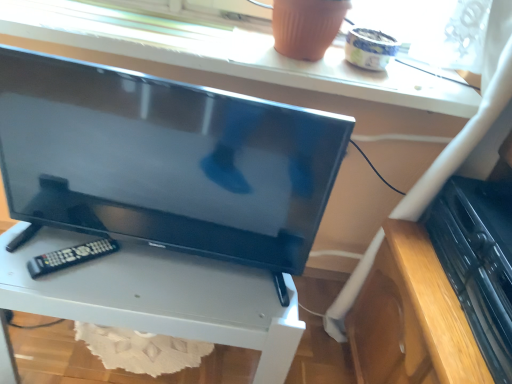
Image resolution: width=512 pixels, height=384 pixels. I want to click on white glossy tv stand at center, so click(158, 296).

What do you see at coordinates (158, 296) in the screenshot? Image resolution: width=512 pixels, height=384 pixels. I see `white glossy tv stand at center` at bounding box center [158, 296].

Find the location of a particular element. black plastic remote at lower left is located at coordinates (70, 256).

Image resolution: width=512 pixels, height=384 pixels. Find the location of `white glossy tv stand at center`. white glossy tv stand at center is located at coordinates (158, 296).

Is matte white window sill at upper center far from matte black tv at center?

matte white window sill at upper center is near matte black tv at center, not far away.

Is point (104, 40) positioned behind point (129, 130)?

Yes, it is.

Which of these two, matte white window sill at upper center or matte black tv at center, is wider?

matte white window sill at upper center is wider.

From the image's perspective, would you say black plastic dvd player at lower right is positioned over white glossy tv stand at center?

Yes, from the image's perspective, black plastic dvd player at lower right is above white glossy tv stand at center.

From a real-world perspective, who is located higher, black plastic dvd player at lower right or white glossy tv stand at center?

In real-world perspective, black plastic dvd player at lower right is above.

Can you tell me how much black plastic dvd player at lower right and white glossy tv stand at center differ in facing direction?

88.2 degrees.

Are black plastic dvd player at lower right and white glossy tv stand at center far apart?

Actually, black plastic dvd player at lower right and white glossy tv stand at center are a little close together.

Which of these two, matte black tv at center or black plastic dvd player at lower right, stands taller?

With more height is matte black tv at center.

Does point (92, 154) lie behind point (504, 224)?

No, (92, 154) is closer to viewer.

Is matte black tv at center wider or thinner than black plastic dvd player at lower right?

matte black tv at center is thinner than black plastic dvd player at lower right.

Considering the relative sizes of white glossy tv stand at center and black plastic dvd player at lower right in the image provided, is white glossy tv stand at center bigger than black plastic dvd player at lower right?

Correct, white glossy tv stand at center is larger in size than black plastic dvd player at lower right.

Is white glossy tv stand at center at the left side of black plastic dvd player at lower right?

Yes, white glossy tv stand at center is to the left of black plastic dvd player at lower right.

Is white glossy tv stand at center positioned with its back to black plastic dvd player at lower right?

white glossy tv stand at center is not turned away from black plastic dvd player at lower right.

You are a GUI agent. You are given a task and a screenshot of the screen. Output one action in this format:
    pyautogui.click(x=<x>, y=<y>)
    Task: Click on the furniture that is in front of the black plastic dvd player at lower right
    
    Given the screenshot: What is the action you would take?
    point(158,296)

From a real-world perspective, is black plastic dvd player at lower right above or below matte black tv at center?

Clearly, from a real-world perspective, black plastic dvd player at lower right is below matte black tv at center.

Is black plastic dvd player at lower right oriented away from matte black tv at center?

No.

From the image's perspective, is black plastic dvd player at lower right located beneath matte black tv at center?

Yes, from the image's perspective, black plastic dvd player at lower right is below matte black tv at center.

Between black plastic dvd player at lower right and matte black tv at center, which one has larger width?

black plastic dvd player at lower right.

Looking at this image, can you see matte white window sill at upper center touching white glossy tv stand at center?

No, matte white window sill at upper center is not in contact with white glossy tv stand at center.

Would you say matte white window sill at upper center is to the left or to the right of white glossy tv stand at center in the picture?

Clearly, matte white window sill at upper center is on the right of white glossy tv stand at center in the image.

Who is more distant, matte white window sill at upper center or white glossy tv stand at center?

matte white window sill at upper center is more distant.

In the scene shown: Considering the sizes of objects matte white window sill at upper center and white glossy tv stand at center in the image provided, who is smaller, matte white window sill at upper center or white glossy tv stand at center?

Smaller between the two is matte white window sill at upper center.

Is point (448, 227) positioned after point (50, 253)?

That is True.

From the image's perspective, between black plastic dvd player at lower right and black plastic remote at lower left, which one is located above?

From the image's view, black plastic dvd player at lower right is above.

From a real-world perspective, is black plastic dvd player at lower right on top of black plastic remote at lower left?

Correct, in the physical world, black plastic dvd player at lower right is higher than black plastic remote at lower left.

In the image, there is a matte white window sill at upper center. What are the coordinates of `television below it (from the image's perspective)` in the screenshot? It's located at (165, 160).

Find the location of `furniture lying on the left of black plastic dvd player at lower right`. furniture lying on the left of black plastic dvd player at lower right is located at coordinates (158, 296).

Which object lies nearer to the anchor point white glossy tv stand at center, matte black tv at center or matte white window sill at upper center?

matte black tv at center is closer to white glossy tv stand at center.

Looking at the image, which one is located further to white glossy tv stand at center, black plastic dvd player at lower right or black plastic remote at lower left?

black plastic dvd player at lower right lies further to white glossy tv stand at center than the other object.

Based on their spatial positions, is white glossy tv stand at center or black plastic remote at lower left further from black plastic dvd player at lower right?

Based on the image, black plastic remote at lower left appears to be further to black plastic dvd player at lower right.

Which object lies nearer to the anchor point matte white window sill at upper center, black plastic dvd player at lower right or white glossy tv stand at center?

black plastic dvd player at lower right.

Estimate the real-world distances between objects in this image. Which object is further from black plastic remote at lower left, white glossy tv stand at center or matte black tv at center?

matte black tv at center is further to black plastic remote at lower left.

Looking at the image, which one is located further to matte white window sill at upper center, black plastic remote at lower left or matte black tv at center?

black plastic remote at lower left is further to matte white window sill at upper center.

Considering their positions, is matte white window sill at upper center positioned further to black plastic remote at lower left than matte black tv at center?

matte white window sill at upper center is further to black plastic remote at lower left.

Considering their positions, is black plastic remote at lower left positioned closer to matte black tv at center than white glossy tv stand at center?

The object closer to matte black tv at center is white glossy tv stand at center.

At what (x,y) coordinates should I click in order to perform the action: click on television between white glossy tv stand at center and black plastic dvd player at lower right from left to right. Please return your answer as a coordinate pair (x, y). Looking at the image, I should click on (x=165, y=160).

I want to click on control between matte white window sill at upper center and white glossy tv stand at center in the vertical direction, so click(70, 256).

The image size is (512, 384). I want to click on television between black plastic remote at lower left and black plastic dvd player at lower right, so click(165, 160).

At what (x,y) coordinates should I click in order to perform the action: click on television between matte white window sill at upper center and black plastic remote at lower left from top to bottom. Please return your answer as a coordinate pair (x, y). This screenshot has height=384, width=512. Looking at the image, I should click on (165, 160).